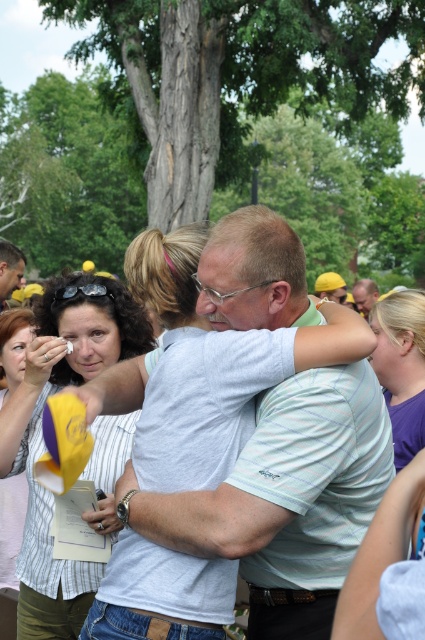
Question: Is matte striped shirt at center to the left of matte white shirt at center from the viewer's perspective?

Choices:
 (A) yes
 (B) no

Answer: (B)

Question: Does light blue striped shirt at center lie in front of matte striped shirt at center?

Choices:
 (A) yes
 (B) no

Answer: (A)

Question: Is matte striped shirt at center bigger than matte gray shirt at center?

Choices:
 (A) no
 (B) yes

Answer: (A)

Question: Which object is farther from the camera taking this photo?

Choices:
 (A) matte striped shirt at center
 (B) purple fabric at right
 (C) matte gray shirt at center

Answer: (C)

Question: Which point appears farthest from the camera in this image?

Choices:
 (A) (414, 340)
 (B) (142, 528)
 (C) (0, 442)
 (D) (11, 268)

Answer: (D)

Question: Based on their relative distances, which object is farther from the light blue striped shirt at center?

Choices:
 (A) matte striped shirt at center
 (B) purple fabric at right

Answer: (B)